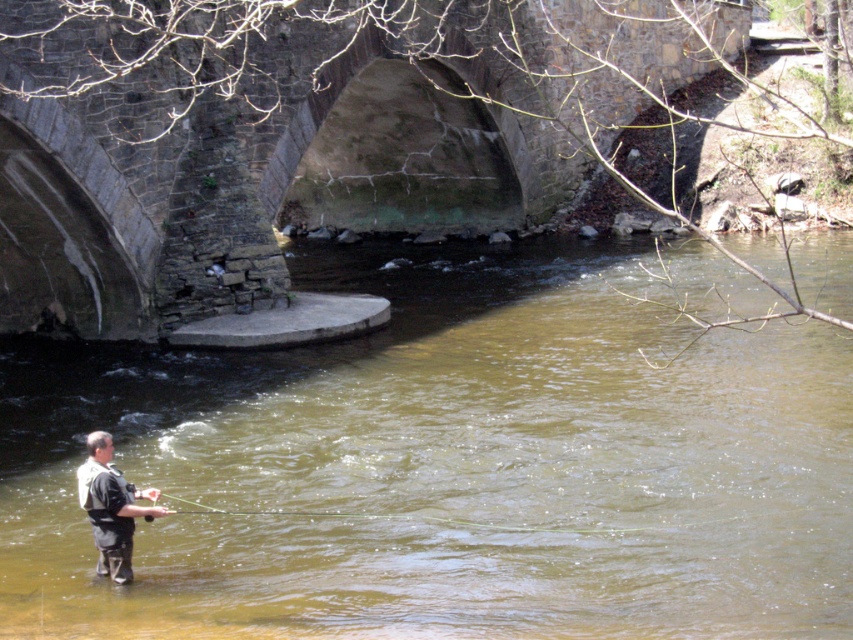
Question: Which object is closer to the camera taking this photo?

Choices:
 (A) brown murky water at center
 (B) dark gray fabric waders at lower left

Answer: (A)

Question: Which point appears closest to the camera in this image?

Choices:
 (A) (99, 470)
 (B) (521, 342)

Answer: (A)

Question: Where is brown murky water at center located in relation to dark gray fabric waders at lower left in the image?

Choices:
 (A) left
 (B) right

Answer: (B)

Question: Which object is farther from the camera taking this photo?

Choices:
 (A) dark gray fabric waders at lower left
 (B) brown murky water at center

Answer: (A)

Question: Is the position of brown murky water at center less distant than that of dark gray fabric waders at lower left?

Choices:
 (A) yes
 (B) no

Answer: (A)

Question: Can you confirm if brown murky water at center is positioned above dark gray fabric waders at lower left?

Choices:
 (A) no
 (B) yes

Answer: (B)